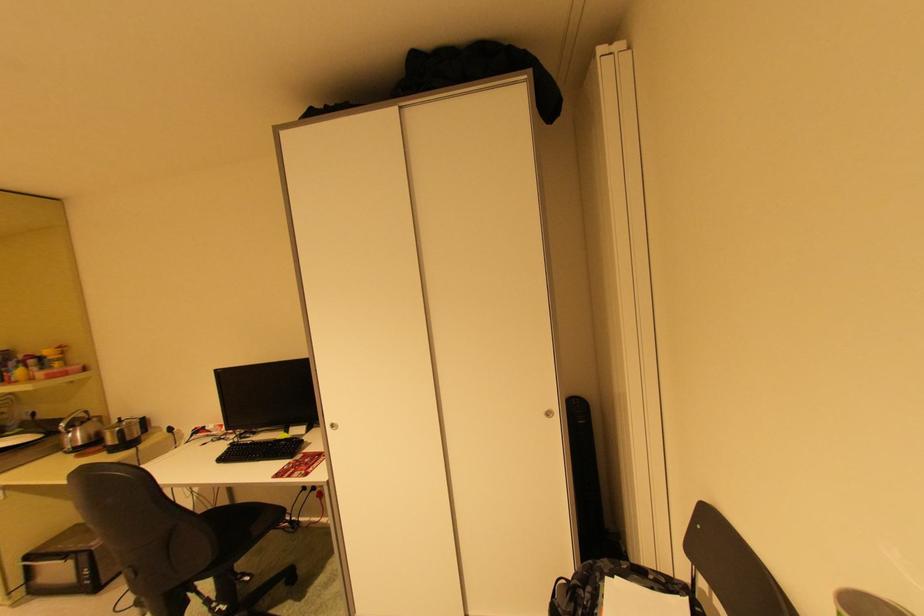
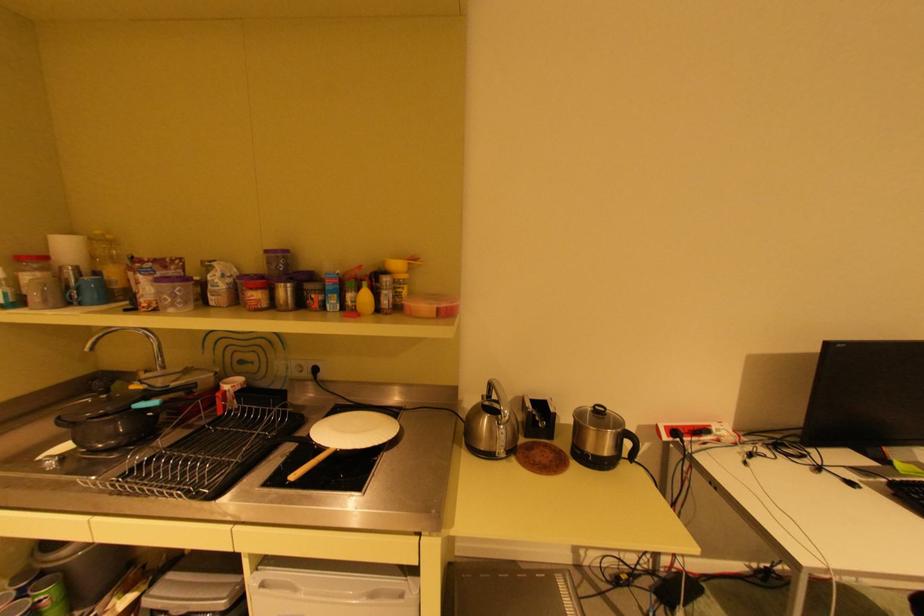
What movement of the cameraman would produce the second image?

The cameraman walked toward left, forward.